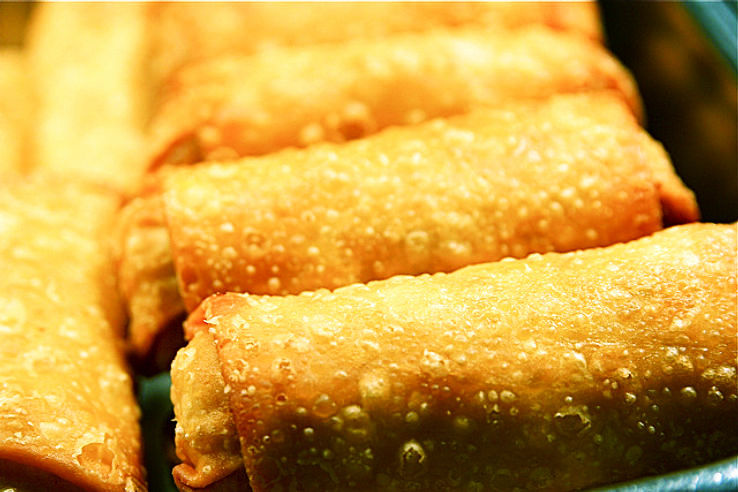
Where is `tray edges`? tray edges is located at coordinates (714, 125), (720, 479).